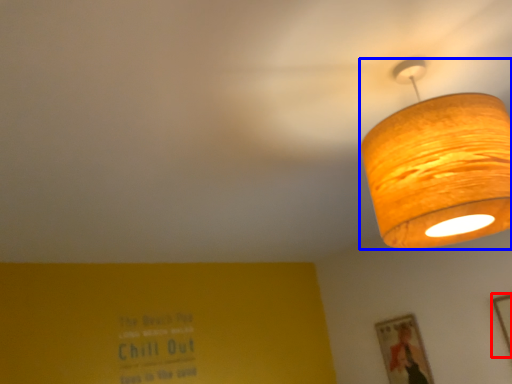
Question: Which point is further to the camera, picture frame (highlighted by a red box) or lamp (highlighted by a blue box)?

Choices:
 (A) picture frame
 (B) lamp

Answer: (A)